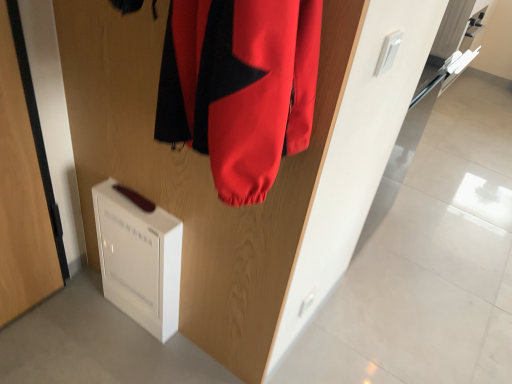
The image size is (512, 384). What are the coordinates of `vacant space that's between white matte door at lower left, the 2th door positioned from the right, and white plastic air purifier at lower left` in the screenshot? It's located at (84, 311).